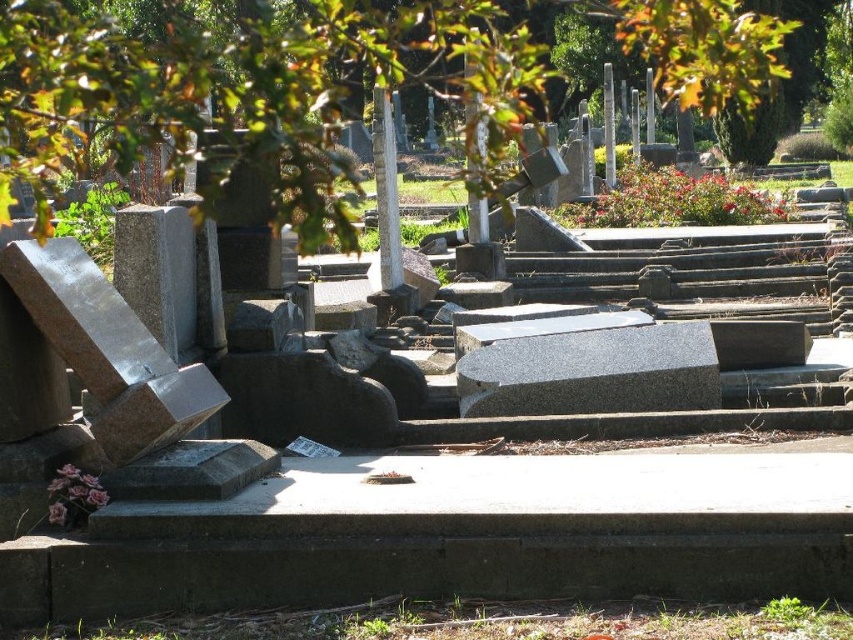
Question: Which point is farther to the camera?

Choices:
 (A) granite at center
 (B) green leafy tree at upper center

Answer: (A)

Question: Can you confirm if green leafy tree at upper center is positioned below granite at center?

Choices:
 (A) yes
 (B) no

Answer: (B)

Question: Among these objects, which one is farthest from the camera?

Choices:
 (A) green leafy tree at upper center
 (B) granite at center

Answer: (B)

Question: Is green leafy tree at upper center closer to camera compared to granite at center?

Choices:
 (A) yes
 (B) no

Answer: (A)

Question: From the image, what is the correct spatial relationship of green leafy tree at upper center in relation to granite at center?

Choices:
 (A) below
 (B) above

Answer: (B)